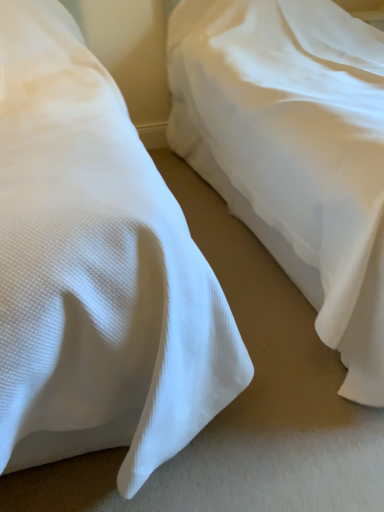
Question: Is white textured pillow at left, which appears as the 1th bed when viewed from the left, placed right next to white textured fabric at center, the 1th bed from the right?

Choices:
 (A) yes
 (B) no

Answer: (B)

Question: Is white textured fabric at center, placed as the 2th bed when sorted from left to right, surrounded by white textured pillow at left, which appears as the 1th bed when viewed from the left?

Choices:
 (A) yes
 (B) no

Answer: (B)

Question: Is white textured pillow at left, which appears as the 1th bed when viewed from the left, to the left of white textured fabric at center, the 1th bed from the right, from the viewer's perspective?

Choices:
 (A) no
 (B) yes

Answer: (B)

Question: Can you confirm if white textured pillow at left, the second bed viewed from the right, is positioned to the right of white textured fabric at center, the 1th bed from the right?

Choices:
 (A) yes
 (B) no

Answer: (B)

Question: From a real-world perspective, is white textured pillow at left, the second bed viewed from the right, below white textured fabric at center, placed as the 2th bed when sorted from left to right?

Choices:
 (A) no
 (B) yes

Answer: (A)

Question: Considering the relative sizes of white textured pillow at left, which appears as the 1th bed when viewed from the left, and white textured fabric at center, placed as the 2th bed when sorted from left to right, in the image provided, is white textured pillow at left, which appears as the 1th bed when viewed from the left, wider than white textured fabric at center, placed as the 2th bed when sorted from left to right,?

Choices:
 (A) yes
 (B) no

Answer: (A)

Question: Does white textured fabric at center, placed as the 2th bed when sorted from left to right, turn towards white textured pillow at left, which appears as the 1th bed when viewed from the left?

Choices:
 (A) yes
 (B) no

Answer: (B)

Question: Is white textured pillow at left, which appears as the 1th bed when viewed from the left, completely or partially inside white textured fabric at center, the 1th bed from the right?

Choices:
 (A) no
 (B) yes

Answer: (A)

Question: Can you confirm if white textured fabric at center, the 1th bed from the right, is shorter than white textured pillow at left, the second bed viewed from the right?

Choices:
 (A) yes
 (B) no

Answer: (A)

Question: Does white textured fabric at center, placed as the 2th bed when sorted from left to right, lie in front of white textured pillow at left, which appears as the 1th bed when viewed from the left?

Choices:
 (A) no
 (B) yes

Answer: (A)

Question: From a real-world perspective, is white textured fabric at center, the 1th bed from the right, on top of white textured pillow at left, the second bed viewed from the right?

Choices:
 (A) no
 (B) yes

Answer: (A)

Question: Is the position of white textured fabric at center, the 1th bed from the right, more distant than that of white textured pillow at left, which appears as the 1th bed when viewed from the left?

Choices:
 (A) yes
 (B) no

Answer: (A)

Question: Is white textured fabric at center, placed as the 2th bed when sorted from left to right, inside or outside of white textured pillow at left, the second bed viewed from the right?

Choices:
 (A) inside
 (B) outside

Answer: (B)